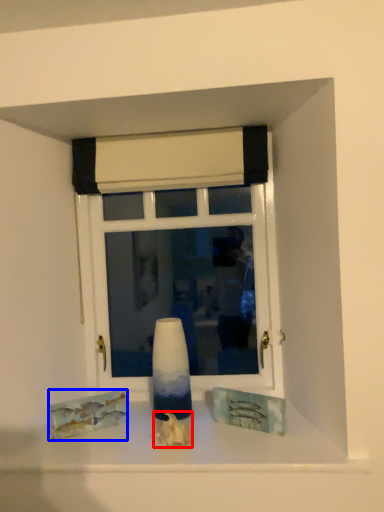
Question: Which of the following is the closest to the observer, art (highlighted by a red box) or art (highlighted by a blue box)?

Choices:
 (A) art
 (B) art

Answer: (A)